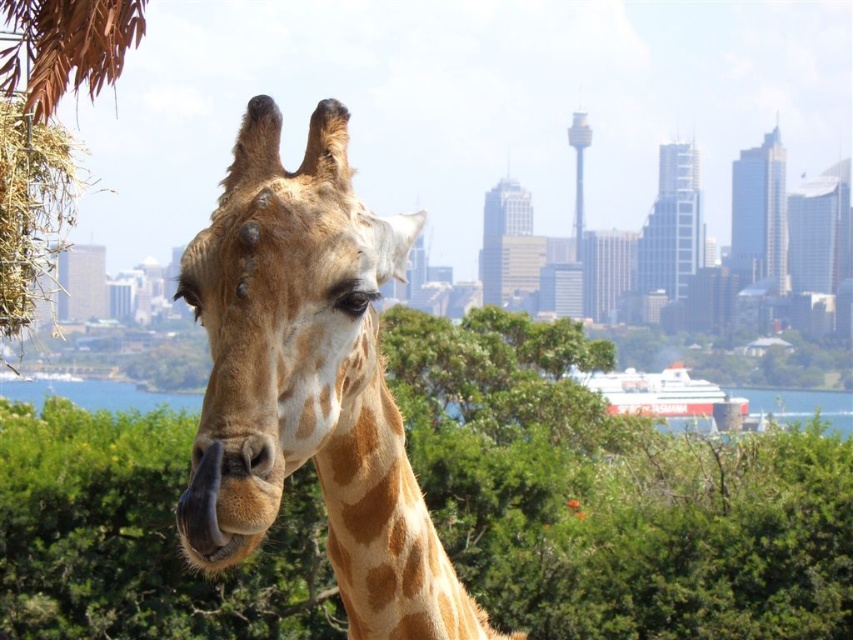
In the scene shown: You are standing in front of the giraffe and want to walk towards the green leafy tree at center. Which direction should you move relative to the giraffe?

The green leafy tree at center is located at point (x=613, y=496), so you should move towards the center of the image relative to the giraffe.

You are a bird flying over the scene and want to land on the green leafy tree at center and clear blue water at center. Which one is on the left side?

The green leafy tree at center is positioned on the left side of clear blue water at center.